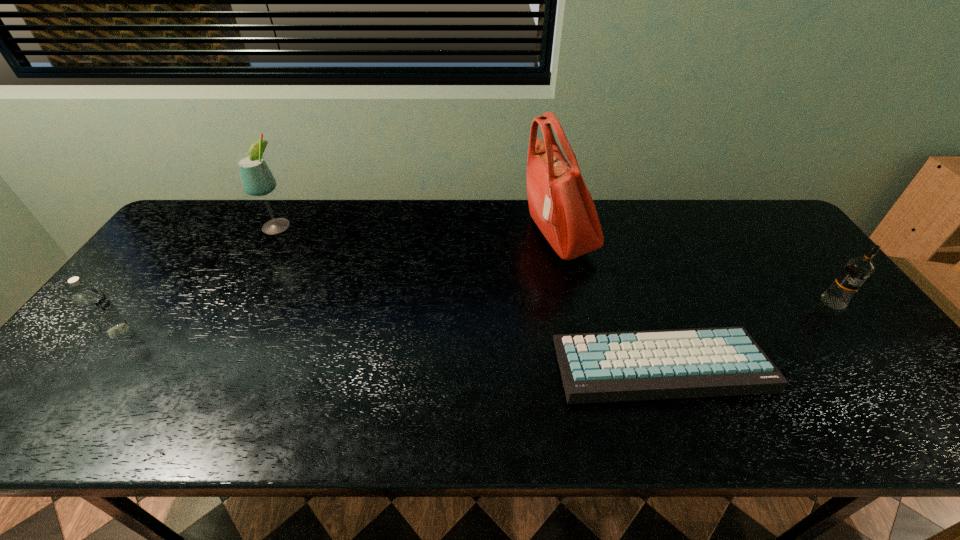
Identify the location of blank space located on the front-facing side of the handbag. The width and height of the screenshot is (960, 540). (409, 235).

Find the location of a particular element. The width and height of the screenshot is (960, 540). free space located 0.340m on the right of the alcohol is located at coordinates (398, 225).

Find the location of a particular element. This screenshot has height=540, width=960. free space located 0.110m on the label of the third nearest object is located at coordinates (866, 345).

Image resolution: width=960 pixels, height=540 pixels. Find the location of `free region located on the front label of the leftmost object`. free region located on the front label of the leftmost object is located at coordinates (255, 331).

The image size is (960, 540). I want to click on vacant space located 0.200m on the right of the computer keyboard, so click(849, 364).

Where is `handbag present at the far edge`? This screenshot has width=960, height=540. handbag present at the far edge is located at coordinates (560, 204).

At what (x,y) coordinates should I click in order to perform the action: click on alcohol that is at the far edge. Please return your answer as a coordinate pair (x, y). Looking at the image, I should click on (257, 179).

Identify the location of object located at the near edge. The height and width of the screenshot is (540, 960). (726, 361).

Where is `object present at the left edge`? This screenshot has height=540, width=960. object present at the left edge is located at coordinates (94, 304).

Where is `object that is at the right edge`? The width and height of the screenshot is (960, 540). object that is at the right edge is located at coordinates (857, 270).